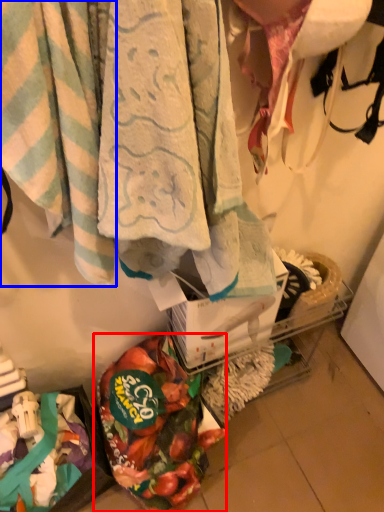
Question: Which object appears closest to the camera in this image, food (highlighted by a red box) or towel (highlighted by a blue box)?

Choices:
 (A) food
 (B) towel

Answer: (B)